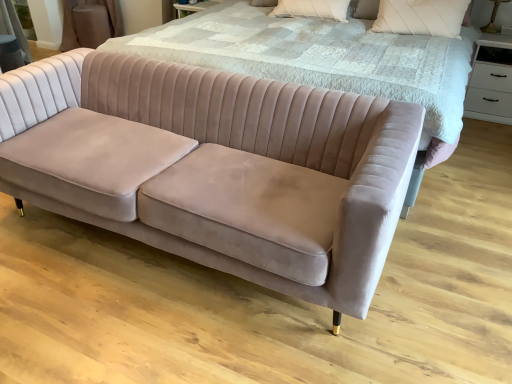
What is the approximate height of white glossy drawer at upper right?

The height of white glossy drawer at upper right is 62.47 centimeters.

Image resolution: width=512 pixels, height=384 pixels. What do you see at coordinates (494, 17) in the screenshot?
I see `matte gold table lamp at upper right` at bounding box center [494, 17].

You are a GUI agent. You are given a task and a screenshot of the screen. Output one action in this format:
    pyautogui.click(x=<x>, y=<y>)
    Task: Click on the white textured pillow at upper center, positioned as the 1th pillow in left-to-right order
    Image resolution: width=512 pixels, height=384 pixels.
    Given the screenshot: What is the action you would take?
    pyautogui.click(x=312, y=9)

Image resolution: width=512 pixels, height=384 pixels. What do you see at coordinates (323, 59) in the screenshot?
I see `velvet bed at center` at bounding box center [323, 59].

Where is `white glossy drawer at upper right`? The image size is (512, 384). white glossy drawer at upper right is located at coordinates (490, 80).

Does velvet bed at center have a lesser width compared to white glossy drawer at upper right?

Incorrect, the width of velvet bed at center is not less than that of white glossy drawer at upper right.

Based on the photo, how much distance is there between velvet bed at center and white glossy drawer at upper right?

velvet bed at center and white glossy drawer at upper right are 1.26 meters apart.

From the picture: Is velvet bed at center looking in the opposite direction of white glossy drawer at upper right?

That's not correct — velvet bed at center is not looking away from white glossy drawer at upper right.

Would you say velvet bed at center is a long distance from white glossy drawer at upper right?

Yes.

In the scene shown: Is white textured pillow at upper center, positioned as the second pillow in right-to-left order, closer to camera compared to velvet beige couch at lower left?

No, the depth of white textured pillow at upper center, positioned as the second pillow in right-to-left order, is greater than that of velvet beige couch at lower left.

Is white textured pillow at upper center, positioned as the second pillow in right-to-left order, to the left or to the right of velvet beige couch at lower left in the image?

white textured pillow at upper center, positioned as the second pillow in right-to-left order, is positioned on velvet beige couch at lower left's right side.

Considering the sizes of objects white textured pillow at upper center, positioned as the second pillow in right-to-left order, and velvet beige couch at lower left in the image provided, who is taller, white textured pillow at upper center, positioned as the second pillow in right-to-left order, or velvet beige couch at lower left?

velvet beige couch at lower left is taller.

Find the location of a particular element. The width and height of the screenshot is (512, 384). the 1st pillow positioned above the velvet beige couch at lower left (from a real-world perspective) is located at coordinates (312, 9).

Relative to matte gold table lamp at upper right, is white textured pillow at upper right, which is the 2th pillow in left-to-right order, in front or behind?

In the image, white textured pillow at upper right, which is the 2th pillow in left-to-right order, appears in front of matte gold table lamp at upper right.

Is white textured pillow at upper right, which is the 2th pillow in left-to-right order, facing away from matte gold table lamp at upper right?

Yes.

Can you tell me how much white textured pillow at upper right, which is the 2th pillow in left-to-right order, and matte gold table lamp at upper right differ in facing direction?

white textured pillow at upper right, which is the 2th pillow in left-to-right order, and matte gold table lamp at upper right are facing 0.224 degrees away from each other.

Considering the sizes of objects white textured pillow at upper right, which is the 2th pillow in left-to-right order, and matte gold table lamp at upper right in the image provided, who is taller, white textured pillow at upper right, which is the 2th pillow in left-to-right order, or matte gold table lamp at upper right?

With more height is white textured pillow at upper right, which is the 2th pillow in left-to-right order.

Which is in front, white glossy drawer at upper right or matte gold table lamp at upper right?

white glossy drawer at upper right is closer to the camera.

Can you confirm if white glossy drawer at upper right is taller than matte gold table lamp at upper right?

Indeed, white glossy drawer at upper right has a greater height compared to matte gold table lamp at upper right.

Looking at their sizes, would you say white glossy drawer at upper right is wider or thinner than matte gold table lamp at upper right?

white glossy drawer at upper right is wider than matte gold table lamp at upper right.

Can you tell me how much white glossy drawer at upper right and matte gold table lamp at upper right differ in facing direction?

They differ by 1.54 degrees in their facing directions.

Can you confirm if velvet beige couch at lower left is taller than white textured pillow at upper center, positioned as the 1th pillow in left-to-right order?

Indeed, velvet beige couch at lower left has a greater height compared to white textured pillow at upper center, positioned as the 1th pillow in left-to-right order.

Would you say white textured pillow at upper center, positioned as the 1th pillow in left-to-right order, is part of velvet beige couch at lower left's contents?

No, white textured pillow at upper center, positioned as the 1th pillow in left-to-right order, is located outside of velvet beige couch at lower left.

Considering the sizes of velvet beige couch at lower left and white textured pillow at upper center, positioned as the second pillow in right-to-left order, in the image, is velvet beige couch at lower left bigger or smaller than white textured pillow at upper center, positioned as the second pillow in right-to-left order,?

Clearly, velvet beige couch at lower left is larger in size than white textured pillow at upper center, positioned as the second pillow in right-to-left order.

How different are the orientations of velvet beige couch at lower left and white textured pillow at upper center, positioned as the second pillow in right-to-left order, in degrees?

velvet beige couch at lower left and white textured pillow at upper center, positioned as the second pillow in right-to-left order, are facing 7.46 degrees away from each other.

Is white textured pillow at upper center, positioned as the second pillow in right-to-left order, shorter than velvet bed at center?

Yes, white textured pillow at upper center, positioned as the second pillow in right-to-left order, is shorter than velvet bed at center.

Which of these two, white textured pillow at upper center, positioned as the second pillow in right-to-left order, or velvet bed at center, is bigger?

velvet bed at center.

From a real-world perspective, is white textured pillow at upper center, positioned as the second pillow in right-to-left order, beneath velvet bed at center?

No, from a real-world perspective, white textured pillow at upper center, positioned as the second pillow in right-to-left order, is not beneath velvet bed at center.

Is white textured pillow at upper center, positioned as the second pillow in right-to-left order, wider than velvet bed at center?

No.

Is white glossy drawer at upper right not inside velvet bed at center?

Yes, white glossy drawer at upper right is outside of velvet bed at center.

From the image's perspective, between white glossy drawer at upper right and velvet bed at center, which one is located above?

From the image's view, velvet bed at center is above.

Is the surface of white glossy drawer at upper right in direct contact with velvet bed at center?

No.

Where is `side table that is behind the velvet bed at center`? The height and width of the screenshot is (384, 512). side table that is behind the velvet bed at center is located at coordinates (490, 80).

Where is `studio couch that appears in front of the white textured pillow at upper center, positioned as the second pillow in right-to-left order`? Image resolution: width=512 pixels, height=384 pixels. studio couch that appears in front of the white textured pillow at upper center, positioned as the second pillow in right-to-left order is located at coordinates (215, 167).

In the scene shown: Considering their positions, is velvet bed at center positioned further to matte gold table lamp at upper right than white glossy drawer at upper right?

Based on the image, velvet bed at center appears to be further to matte gold table lamp at upper right.

Based on their spatial positions, is matte gold table lamp at upper right or velvet beige couch at lower left further from white glossy drawer at upper right?

velvet beige couch at lower left.

Which object lies nearer to the anchor point white glossy drawer at upper right, velvet bed at center or white textured pillow at upper right, which is the 2th pillow in left-to-right order?

white textured pillow at upper right, which is the 2th pillow in left-to-right order, lies closer to white glossy drawer at upper right than the other object.

Estimate the real-world distances between objects in this image. Which object is closer to velvet bed at center, white textured pillow at upper right, marked as the first pillow in a right-to-left arrangement, or white glossy drawer at upper right?

white textured pillow at upper right, marked as the first pillow in a right-to-left arrangement, lies closer to velvet bed at center than the other object.

Looking at this image, looking at the image, which one is located closer to velvet bed at center, white textured pillow at upper center, positioned as the 1th pillow in left-to-right order, or velvet beige couch at lower left?

velvet beige couch at lower left is positioned closer to the anchor velvet bed at center.

From the image, which object appears to be nearer to velvet bed at center, matte gold table lamp at upper right or white glossy drawer at upper right?

white glossy drawer at upper right is positioned closer to the anchor velvet bed at center.

From the image, which object appears to be nearer to white textured pillow at upper center, positioned as the 1th pillow in left-to-right order, velvet beige couch at lower left or white glossy drawer at upper right?

white glossy drawer at upper right is closer to white textured pillow at upper center, positioned as the 1th pillow in left-to-right order.

From the image, which object appears to be nearer to velvet bed at center, white glossy drawer at upper right or white textured pillow at upper center, positioned as the second pillow in right-to-left order?

white textured pillow at upper center, positioned as the second pillow in right-to-left order, is closer to velvet bed at center.

Find the location of a particular element. This screenshot has height=384, width=512. bed located between velvet beige couch at lower left and white textured pillow at upper right, marked as the first pillow in a right-to-left arrangement, in the depth direction is located at coordinates (323, 59).

You are a GUI agent. You are given a task and a screenshot of the screen. Output one action in this format:
    pyautogui.click(x=<x>, y=<y>)
    Task: Click on the table lamp situated between white textured pillow at upper right, which is the 2th pillow in left-to-right order, and white glossy drawer at upper right from left to right
    This screenshot has width=512, height=384.
    Given the screenshot: What is the action you would take?
    pyautogui.click(x=494, y=17)

Find the location of a particular element. The image size is (512, 384). bed between velvet beige couch at lower left and white textured pillow at upper center, positioned as the 1th pillow in left-to-right order, in the front-back direction is located at coordinates (323, 59).

Locate an element on the screen. table lamp between white textured pillow at upper center, positioned as the second pillow in right-to-left order, and white glossy drawer at upper right, in the horizontal direction is located at coordinates (494, 17).